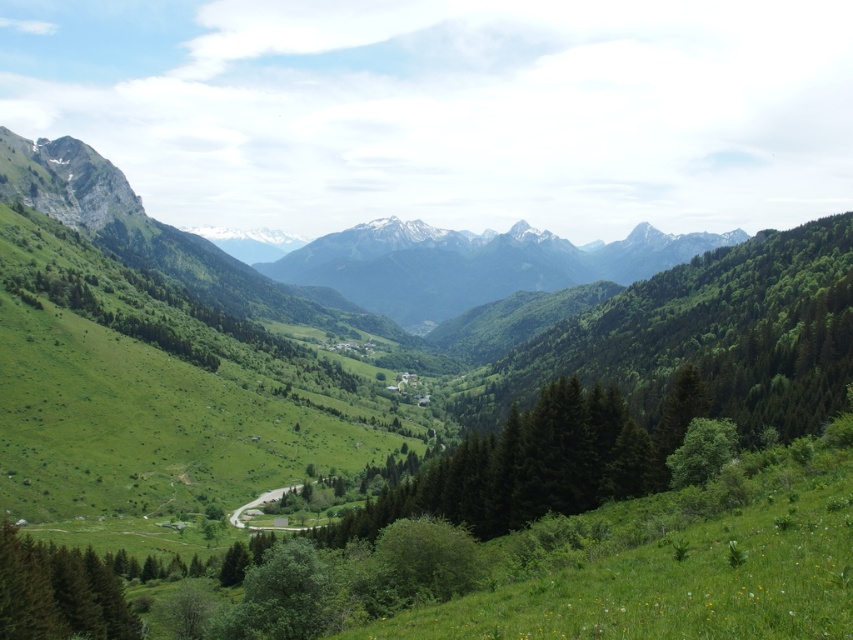
Question: Does green grassy mountain range at center have a greater width compared to green forested mountain range at center?

Choices:
 (A) no
 (B) yes

Answer: (A)

Question: Which point is closer to the camera?

Choices:
 (A) click(x=9, y=532)
 (B) click(x=128, y=216)
 (C) click(x=503, y=236)

Answer: (A)

Question: Which of the following is the closest to the observer?

Choices:
 (A) green matte tree at lower left
 (B) green grassy mountain range at center

Answer: (A)

Question: Which of these objects is positioned farthest from the green forested mountain range at center?

Choices:
 (A) green grassy mountain range at center
 (B) green matte tree at lower left

Answer: (B)

Question: In this image, where is green forested mountain range at center located relative to green matte tree at lower left?

Choices:
 (A) below
 (B) above

Answer: (B)

Question: Does green grassy mountain range at center lie in front of green forested mountain range at center?

Choices:
 (A) yes
 (B) no

Answer: (A)